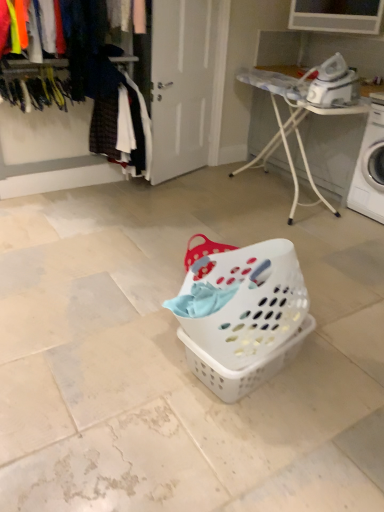
Locate an element on the screen. free space to the left of white plastic laundry basket at center is located at coordinates (141, 364).